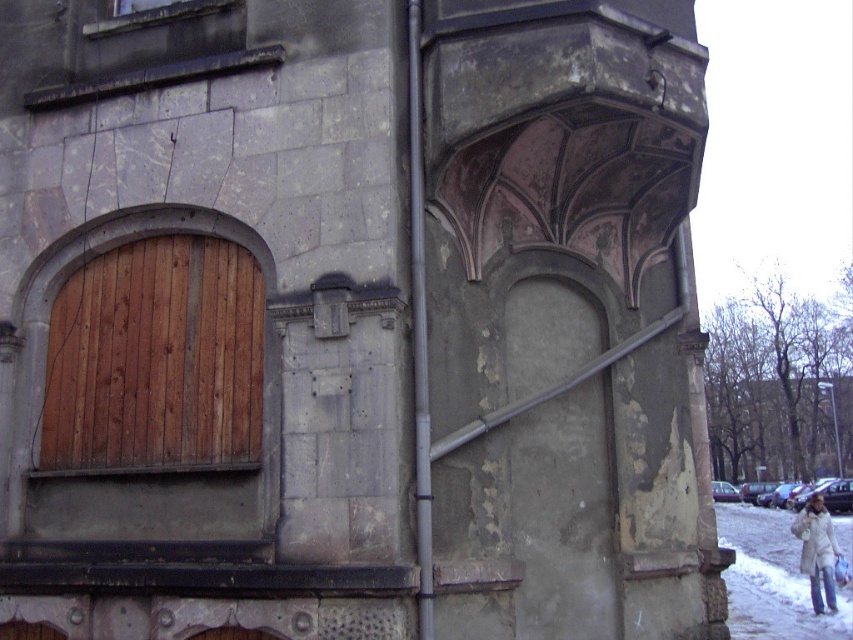
Based on the photo, how much distance is there between white snow at lower right and white fuzzy coat at lower right?

3.63 feet

Which is in front, point (782, 598) or point (817, 612)?

Point (817, 612) is more forward.

The width and height of the screenshot is (853, 640). I want to click on white snow at lower right, so click(770, 579).

Find the location of `white snow at lower right`. white snow at lower right is located at coordinates (770, 579).

How much distance is there between wooden at left and white fuzzy coat at lower right?

The distance of wooden at left from white fuzzy coat at lower right is 10.82 meters.

Between point (77, 339) and point (833, 592), which one is positioned in front?

Positioned in front is point (77, 339).

Find the location of a particular element. wooden at left is located at coordinates (155, 360).

In order to click on wooden at left in this screenshot , I will do `click(155, 360)`.

Is wooden at left further to the viewer compared to white snow at lower right?

No, wooden at left is closer to the viewer.

Where is `wooden at left`? wooden at left is located at coordinates (155, 360).